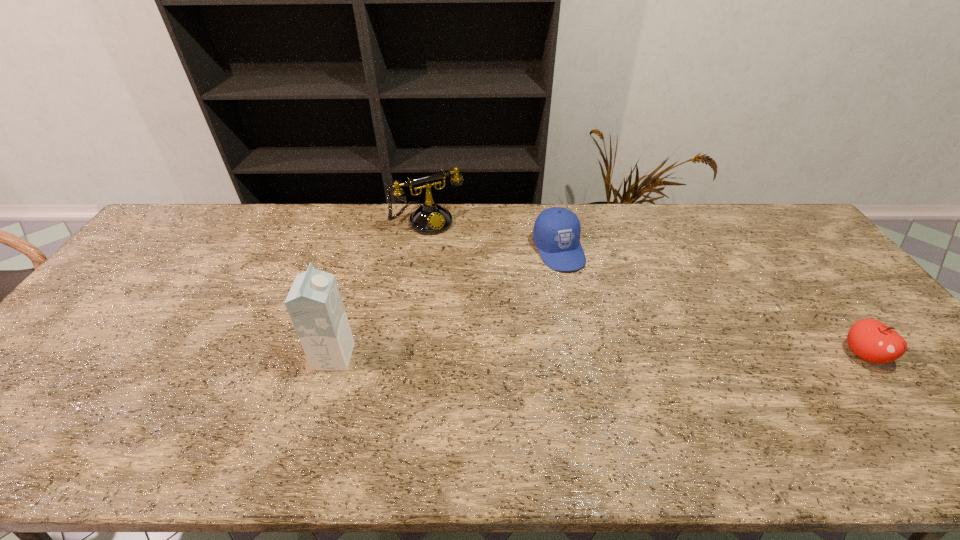
Locate an element on the screen. Image resolution: width=960 pixels, height=540 pixels. vacant area at the right edge is located at coordinates (849, 308).

The image size is (960, 540). Find the location of `vacant space at the far left corner of the desktop`. vacant space at the far left corner of the desktop is located at coordinates (210, 212).

This screenshot has height=540, width=960. I want to click on free area in between the tallest object and the telephone, so click(x=381, y=289).

At what (x,y) coordinates should I click in order to perform the action: click on vacant area that lies between the rightmost object and the tallest object. Please return your answer as a coordinate pair (x, y). Looking at the image, I should click on (599, 355).

Where is `empty location between the second object from left to right and the rightmost object`? Image resolution: width=960 pixels, height=540 pixels. empty location between the second object from left to right and the rightmost object is located at coordinates (646, 287).

Identify the location of free space between the apple and the third object from left to right. coord(711,302).

This screenshot has height=540, width=960. Find the location of `free point between the carton and the second object from right to left`. free point between the carton and the second object from right to left is located at coordinates (446, 303).

Identify the location of vacant area that lies between the rightmost object and the telephone. The image size is (960, 540). (646, 287).

The width and height of the screenshot is (960, 540). Find the location of `empty location between the leftmost object and the cap`. empty location between the leftmost object and the cap is located at coordinates (446, 303).

Find the location of `vacant region between the tallest object and the second object from right to left`. vacant region between the tallest object and the second object from right to left is located at coordinates (x=446, y=303).